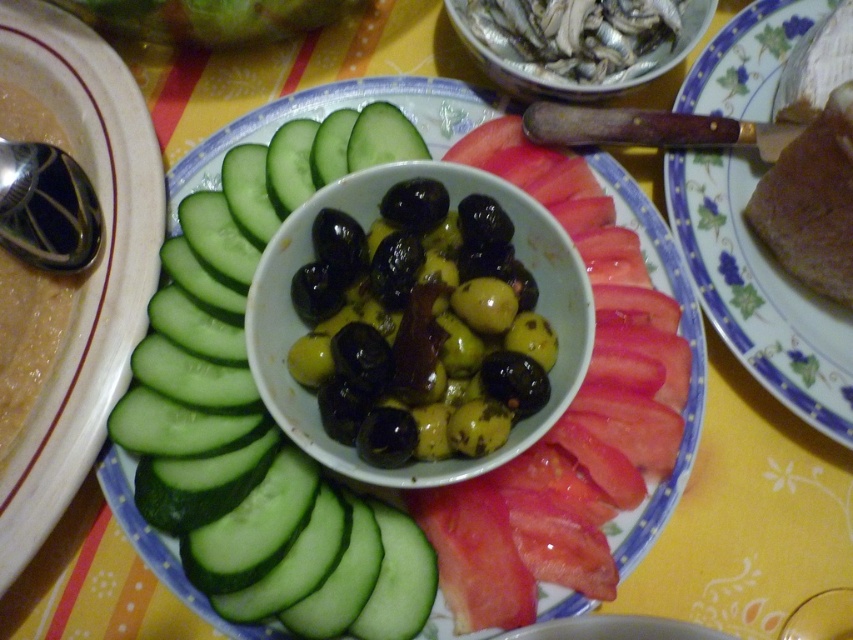
You are a food critic analyzing the arrangement of the plate. Based on the spatial positioning, which item is positioned closer to you between the green smooth cucumber at left and the brown matte bread at right?

The green smooth cucumber at left is closer to the viewer than the brown matte bread at right.

You are arranging a food platter and need to place the green smooth cucumber at left and brown matte bread at right. According to the scene, which item is positioned to the left of the other?

The green smooth cucumber at left is positioned to the left of brown matte bread at right.

You are a food critic analyzing the arrangement of the food on the plate. You notice two points marked on the image. Which point, point [262,436] or point [695,80], is positioned closer to your viewpoint?

Point [262,436] is closer to the viewer than point [695,80].